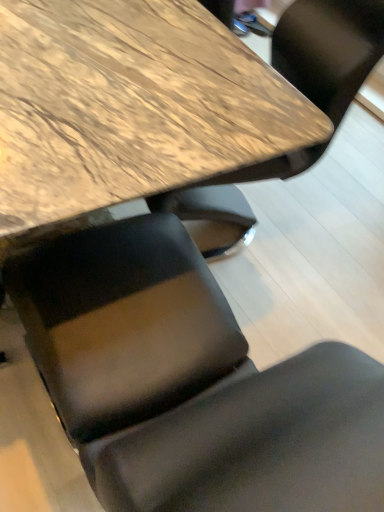
The width and height of the screenshot is (384, 512). Find the location of `matte black chair at lower center`. matte black chair at lower center is located at coordinates (189, 383).

This screenshot has width=384, height=512. Describe the element at coordinates (189, 383) in the screenshot. I see `matte black chair at lower center` at that location.

Find the location of `wooden table at upper center`. wooden table at upper center is located at coordinates (131, 110).

In order to face wooden table at upper center, should I rotate leftwards or rightwards?

To align with it, rotate left about 18.011°.

Image resolution: width=384 pixels, height=512 pixels. What do you see at coordinates (131, 110) in the screenshot?
I see `wooden table at upper center` at bounding box center [131, 110].

Where is `matte black chair at lower center`? This screenshot has height=512, width=384. matte black chair at lower center is located at coordinates (189, 383).

Based on their positions, is matte black chair at lower center located to the left or right of wooden table at upper center?

matte black chair at lower center is positioned on wooden table at upper center's right side.

Which object is closer to the camera taking this photo, matte black chair at lower center or wooden table at upper center?

Positioned in front is matte black chair at lower center.

Is point (249, 482) behind point (30, 223)?

No, (249, 482) is closer to viewer.

From the image's perspective, is matte black chair at lower center positioned above or below wooden table at upper center?

From the image's perspective, matte black chair at lower center appears below wooden table at upper center.

In the scene shown: From a real-world perspective, is matte black chair at lower center under wooden table at upper center?

Incorrect, from a real-world perspective, matte black chair at lower center is higher than wooden table at upper center.

Is matte black chair at lower center wider or thinner than wooden table at upper center?

In the image, matte black chair at lower center appears to be more narrow than wooden table at upper center.

Between matte black chair at lower center and wooden table at upper center, which one has less height?

wooden table at upper center.

Who is smaller, matte black chair at lower center or wooden table at upper center?

With smaller size is matte black chair at lower center.

Can we say matte black chair at lower center lies outside wooden table at upper center?

Yes.

Are matte black chair at lower center and wooden table at upper center making contact?

No, matte black chair at lower center is not making contact with wooden table at upper center.

Is matte black chair at lower center facing away from wooden table at upper center?

matte black chair at lower center is not turned away from wooden table at upper center.

How different are the orientations of matte black chair at lower center and wooden table at upper center in degrees?

The angular difference between matte black chair at lower center and wooden table at upper center is 174 degrees.

This screenshot has width=384, height=512. Identify the location of chair above the wooden table at upper center (from a real-world perspective). (189, 383).

Considering the positions of objects wooden table at upper center and matte black chair at lower center in the image provided, who is more to the right, wooden table at upper center or matte black chair at lower center?

Positioned to the right is matte black chair at lower center.

Is wooden table at upper center in front of matte black chair at lower center?

No, wooden table at upper center is behind matte black chair at lower center.

Is point (270, 97) more distant than point (247, 499)?

Yes, it is behind point (247, 499).

From the image's perspective, is wooden table at upper center above matte black chair at lower center?

Yes, from the image's perspective, wooden table at upper center is above matte black chair at lower center.

From a real-world perspective, which is physically above, wooden table at upper center or matte black chair at lower center?

matte black chair at lower center is physically above.

Which of these two, wooden table at upper center or matte black chair at lower center, is wider?

wooden table at upper center is wider.

Considering the sizes of objects wooden table at upper center and matte black chair at lower center in the image provided, who is shorter, wooden table at upper center or matte black chair at lower center?

Standing shorter between the two is wooden table at upper center.

Can you confirm if wooden table at upper center is smaller than matte black chair at lower center?

Actually, wooden table at upper center might be larger than matte black chair at lower center.

Is wooden table at upper center outside of matte black chair at lower center?

Yes, wooden table at upper center is not within matte black chair at lower center.

Is wooden table at upper center not near matte black chair at lower center?

No.

Could you tell me if wooden table at upper center is turned towards matte black chair at lower center?

Yes.

In the scene shown: How many degrees apart are the facing directions of wooden table at upper center and matte black chair at lower center?

The angular difference between wooden table at upper center and matte black chair at lower center is 174 degrees.

The height and width of the screenshot is (512, 384). Find the location of `table behind the matte black chair at lower center`. table behind the matte black chair at lower center is located at coordinates (131, 110).

In the image, there is a matte black chair at lower center. What are the coordinates of `table below it (from a real-world perspective)` in the screenshot? It's located at (131, 110).

Find the location of `table above the matte black chair at lower center (from the image's perspective)`. table above the matte black chair at lower center (from the image's perspective) is located at coordinates (131, 110).